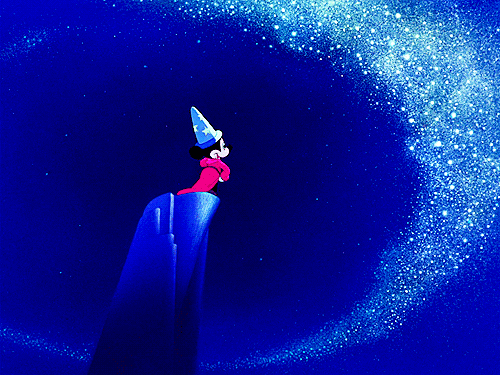
Where is `blue vertical pillar`? This screenshot has width=500, height=375. blue vertical pillar is located at coordinates (161, 256).